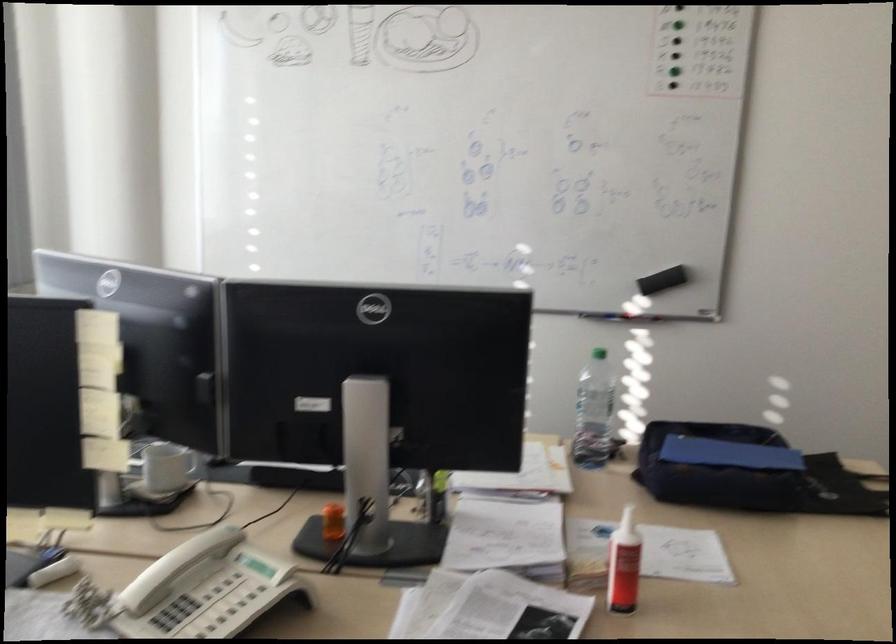
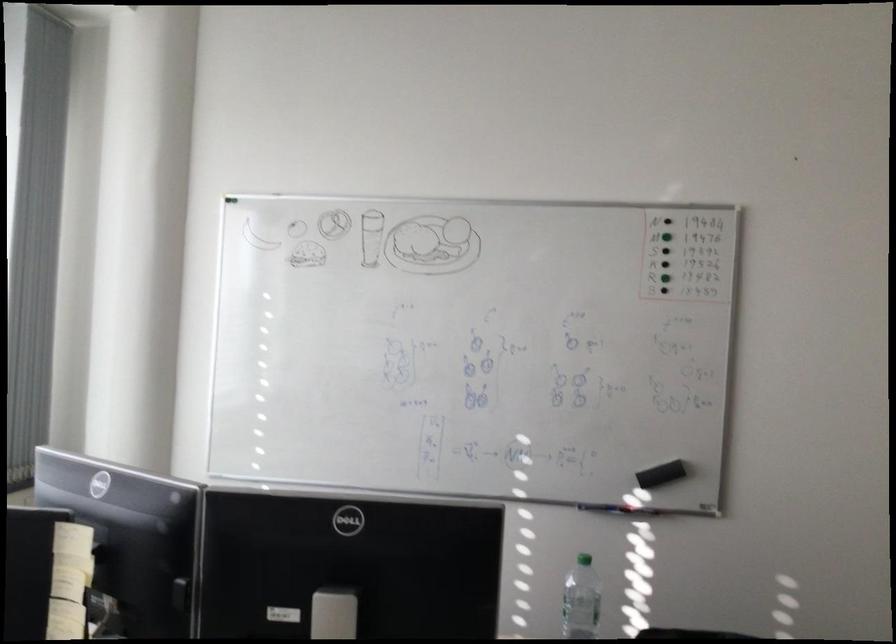
Question: Based on the continuous images, in which direction is the camera rotating? Reply with the corresponding letter.

Choices:
 (A) Left
 (B) Right
 (C) Up
 (D) Down

Answer: (C)